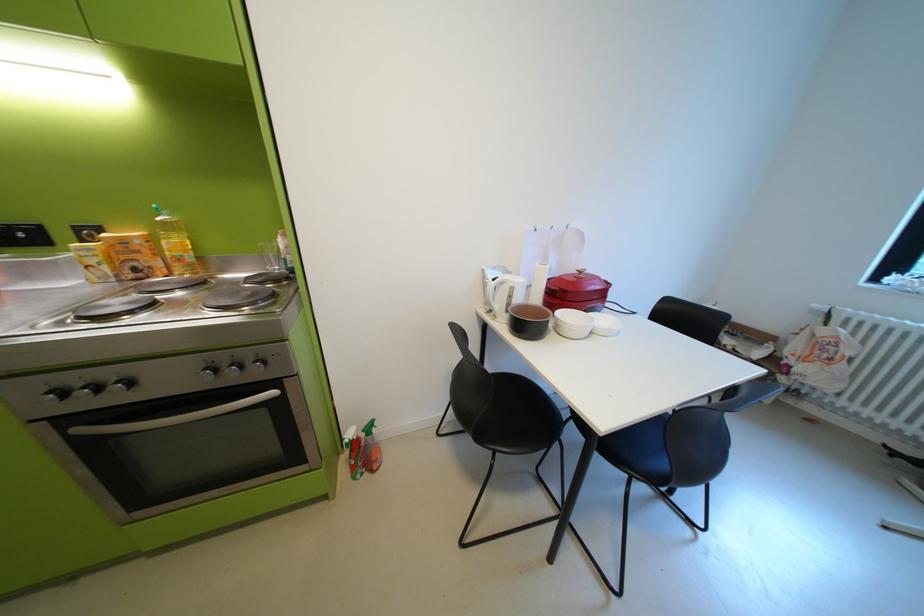
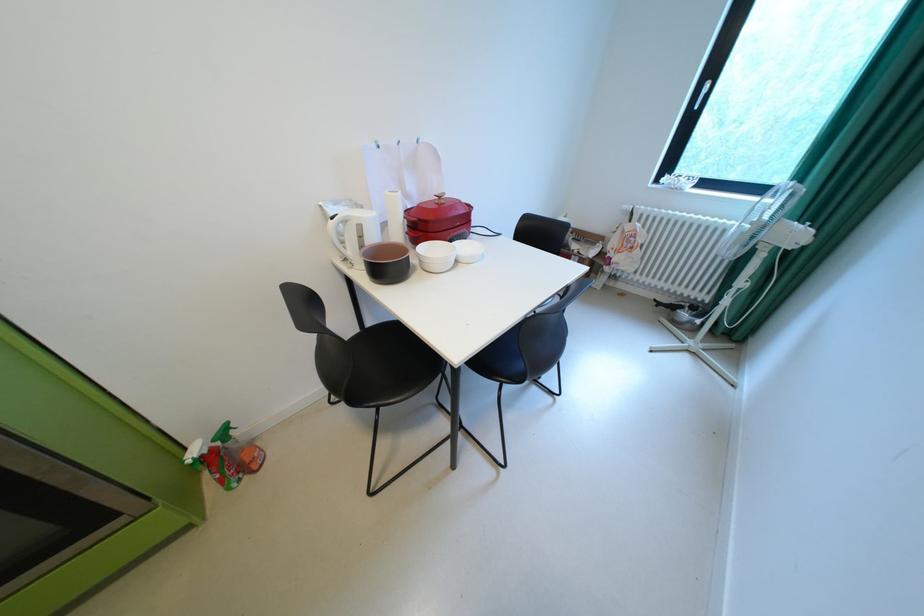
Where in the second image is the point corresponding to (x=523, y=290) from the first image?

(370, 227)